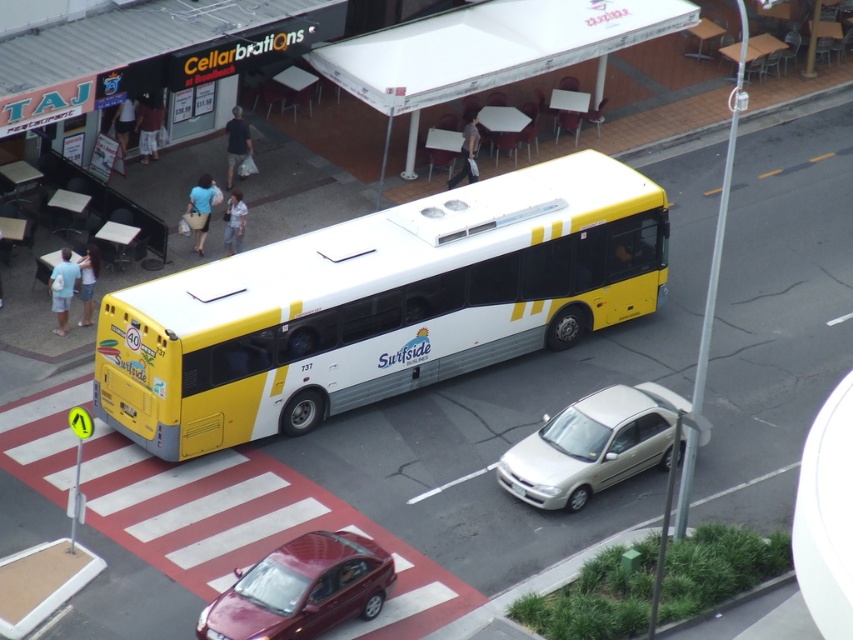
You are a delivery driver needing to park your 2.5 meter wide truck in this street scene. The truck must fit between the yellow matte bus at center and the shiny maroon sedan at lower center. Can you safely park there?

The yellow matte bus at center might be wider than shiny maroon sedan at lower center, so there may not be enough space between them for the truck. It is uncertain if the truck can safely park there without overlapping the vehicles.

From the picture: You are a delivery drone flying at an altitude of 10 meters. You need to deliver a package to a nearby location. The yellow matte bus at center is in your path. Can you safely fly over it without any obstacles?

The yellow matte bus at center is 24.48 meters away from the camera. Since you are flying at 10 meters altitude, you can safely fly over it as your altitude is higher than the bus height.